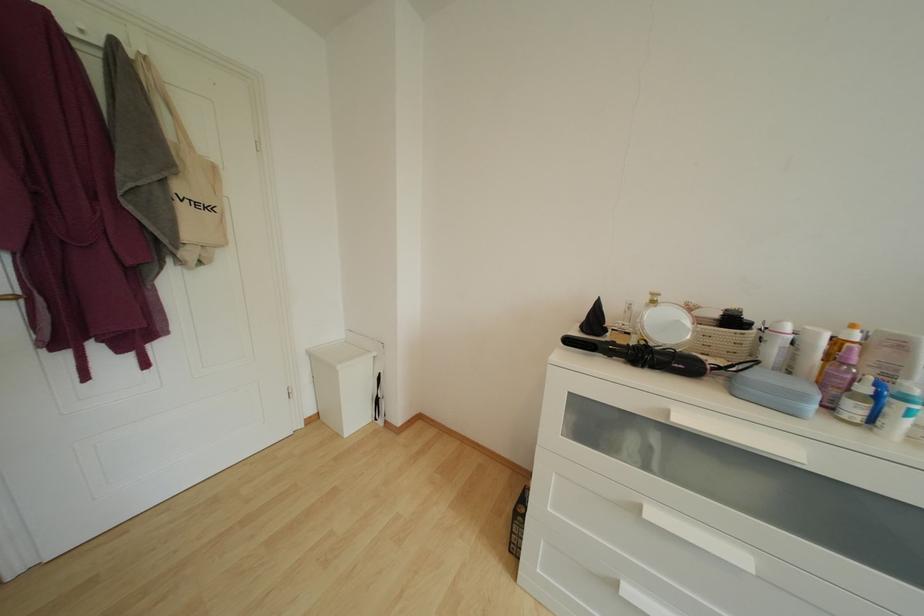
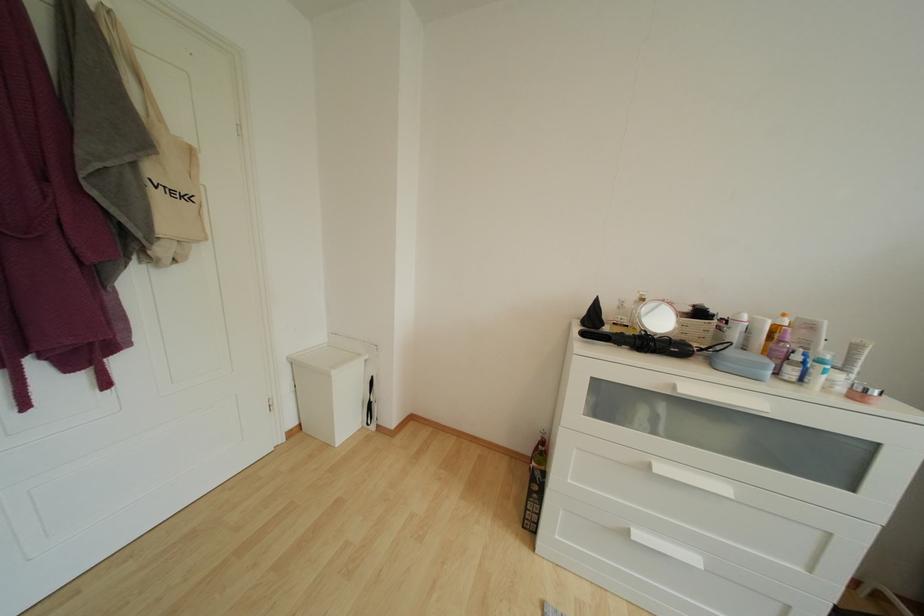
Question: The camera is either moving clockwise (left) or counter-clockwise (right) around the object. The first image is from the beginning of the video and the second image is from the end. Is the camera moving left or right when shooting the video?

Choices:
 (A) Left
 (B) Right

Answer: (A)